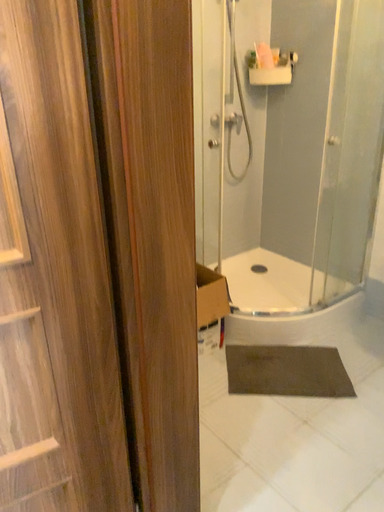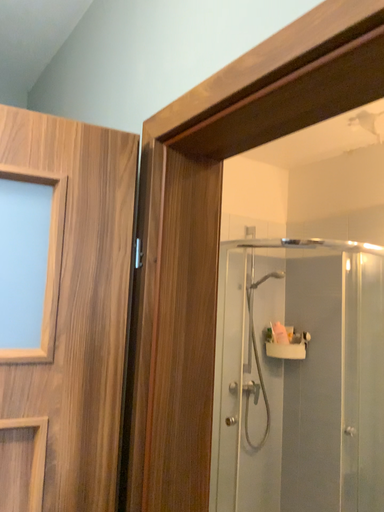
Question: Which way did the camera rotate in the video?

Choices:
 (A) rotated upward
 (B) rotated downward

Answer: (A)